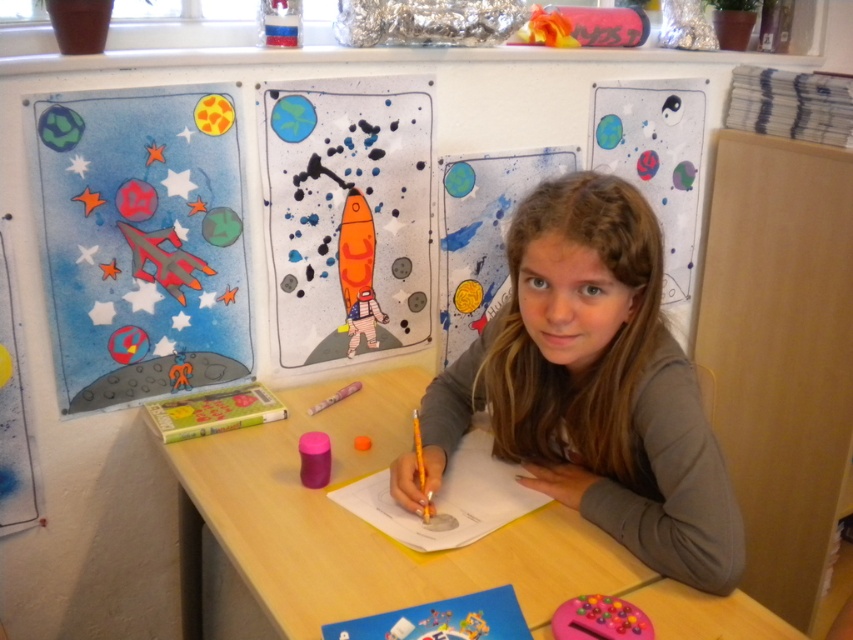
The girl has two items at the center of the desk. Which one is wider, the smooth brown hair at center or the orange matte pencil at center?

The smooth brown hair at center is wider than the orange matte pencil at center.